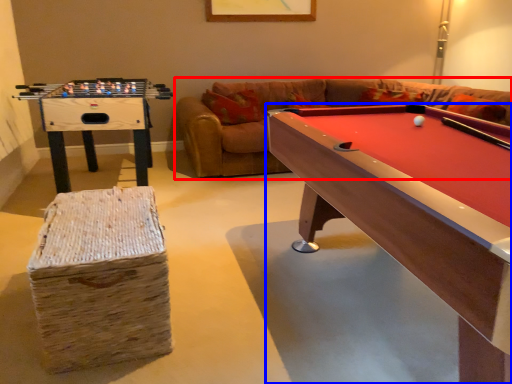
Question: Which object is closer to the camera taking this photo, couch (highlighted by a red box) or billiard table (highlighted by a blue box)?

Choices:
 (A) couch
 (B) billiard table

Answer: (B)